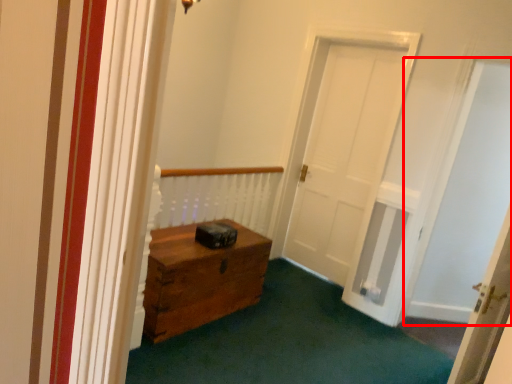
Question: From the image, what is the correct spatial relationship of passage (annotated by the red box) in relation to door?

Choices:
 (A) left
 (B) right

Answer: (B)